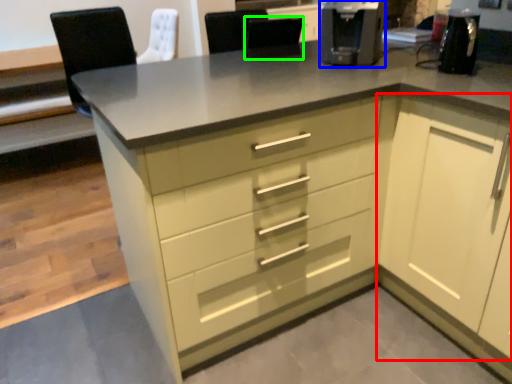
Question: Estimate the real-world distances between objects in this image. Which object is closer to cabinetry (highlighted by a red box), coffee machine (highlighted by a blue box) or chair (highlighted by a green box)?

Choices:
 (A) coffee machine
 (B) chair

Answer: (A)